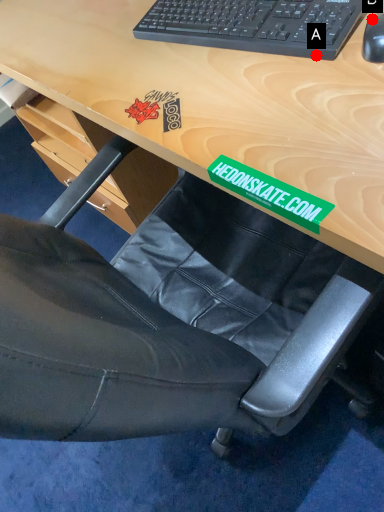
Question: Two points are circled on the image, labeled by A and B beside each circle. Which point is further to the camera?

Choices:
 (A) A is further
 (B) B is further

Answer: (B)